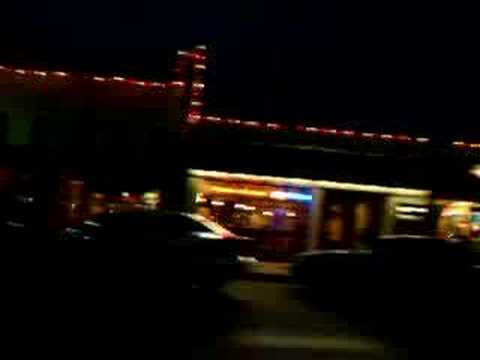
At what (x,y) coordinates should I click in order to perform the action: click on long, continuous yellow strip light. Please return your answer as a coordinate pair (x, y). Looking at the image, I should click on (360, 189).